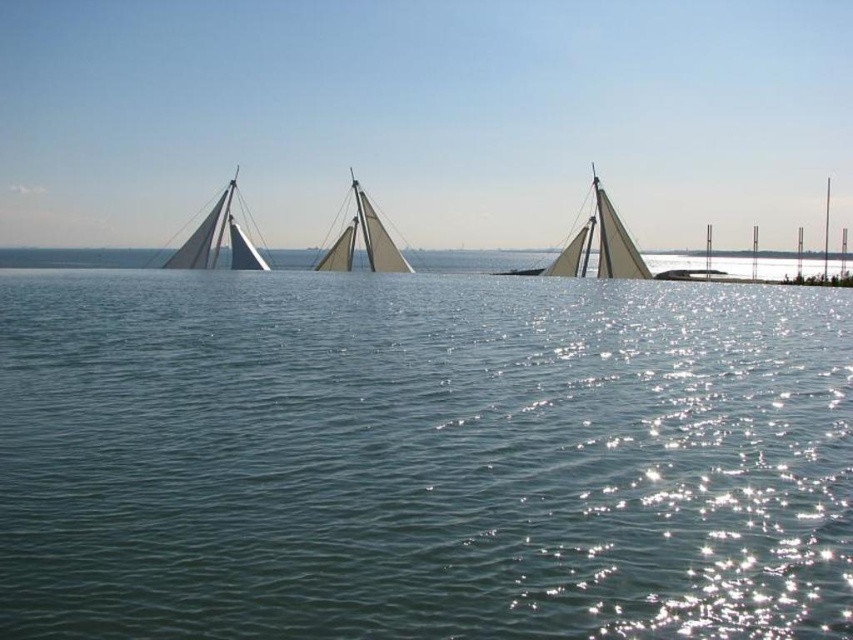
You are a photographer planning to capture a wide shot of the white matte sailboat at center and the white canvas sailboat at center. Given their widths, which one would appear smaller in the photograph?

The white matte sailboat at center has a lesser width compared to the white canvas sailboat at center, so it would appear smaller in the photograph.

You are a sailor navigating a small boat and see two points on your radar. The first point is labeled as point (585, 227) and the second is point (347, 237). According to the scene, which point is closer to your boat?

Point (585, 227) is in front of point (347, 237), so the first point is closer to your boat.

You are a sailor navigating a boat and you see the point marked at coordinates [421,458]. What is the location of this point in the scene?

The point at coordinates [421,458] represents the clear blue water at center.